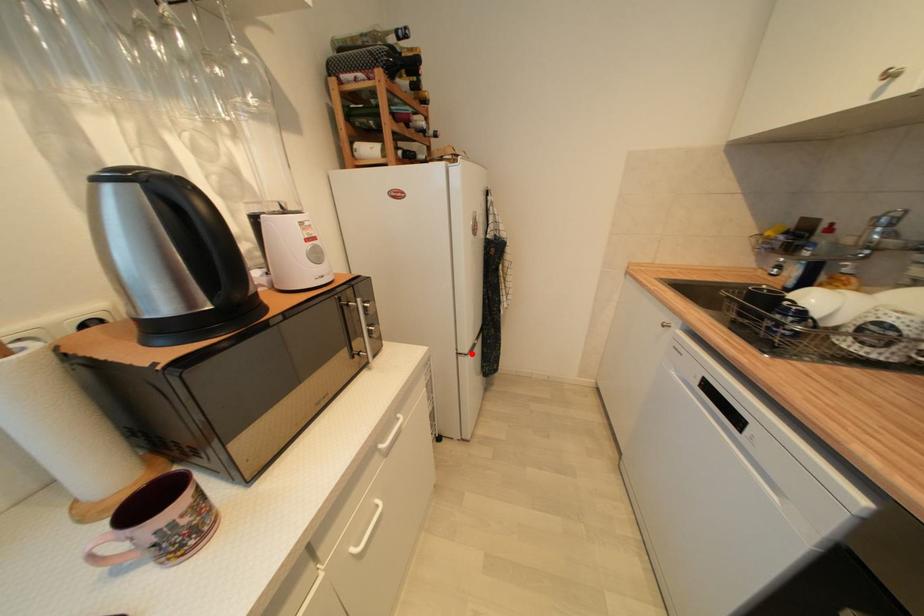
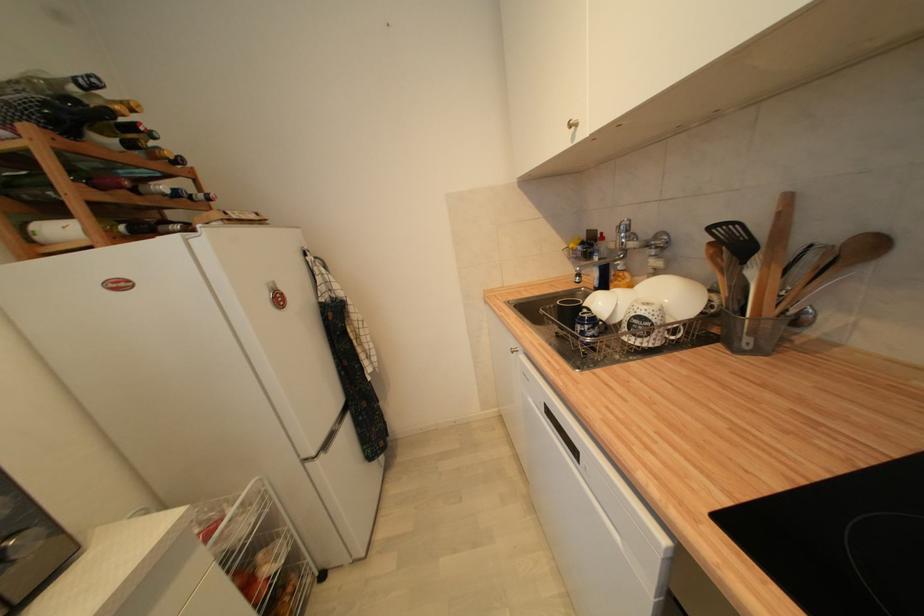
Question: I am providing you with two images of the same scene from different viewpoints. Image1 has a red point marked. In image2, the corresponding 3D location appears at what relative position? Reply with the corresponding letter.

Choices:
 (A) Closer
 (B) Farther

Answer: (A)